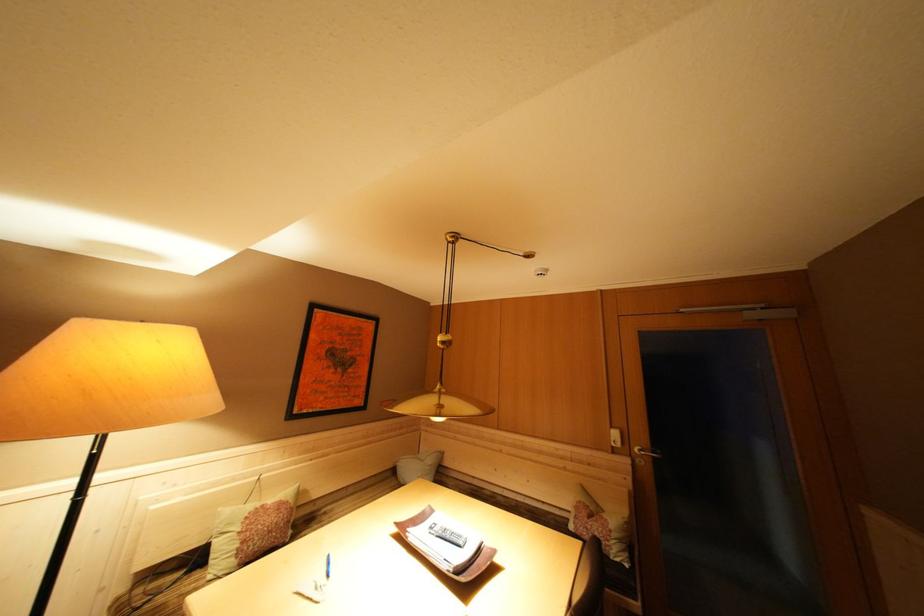
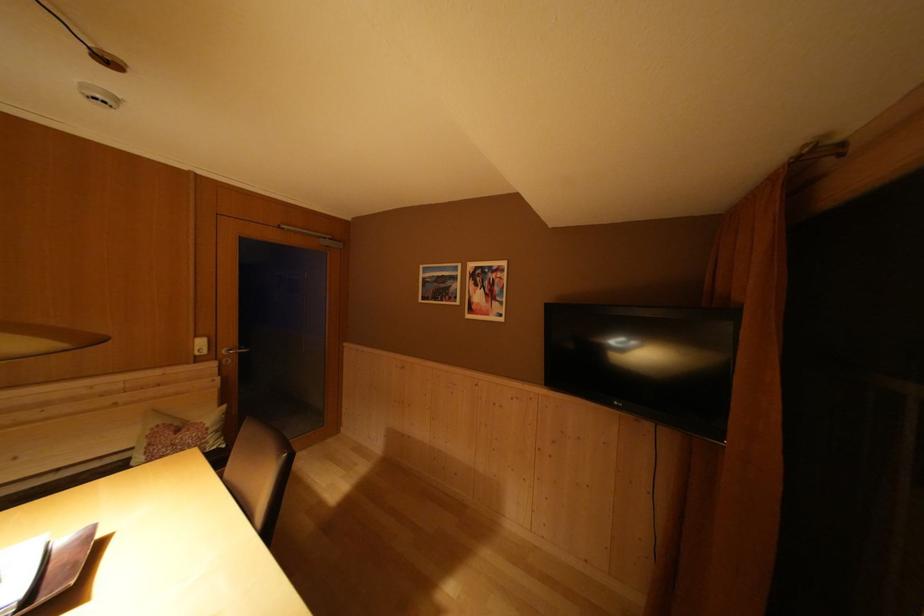
The point at (634, 570) is marked in the first image. Where is the corresponding point in the second image?

(231, 451)